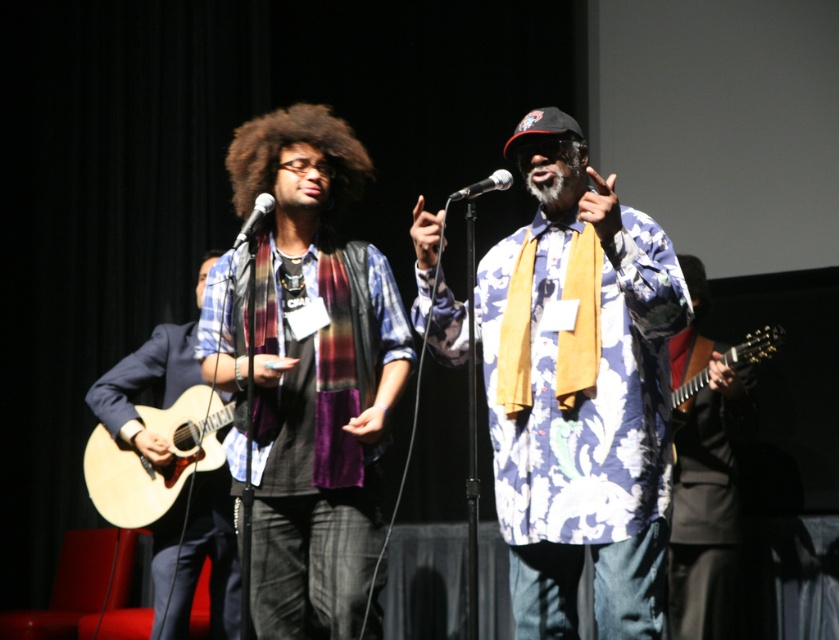
You are an audience member sitting in the front row and see both the black glossy guitar at right and the light brown acoustic guitar at left. Which guitar is positioned lower in the stage setup?

The black glossy guitar at right is located below the light brown acoustic guitar at left, so it is positioned lower in the stage setup.